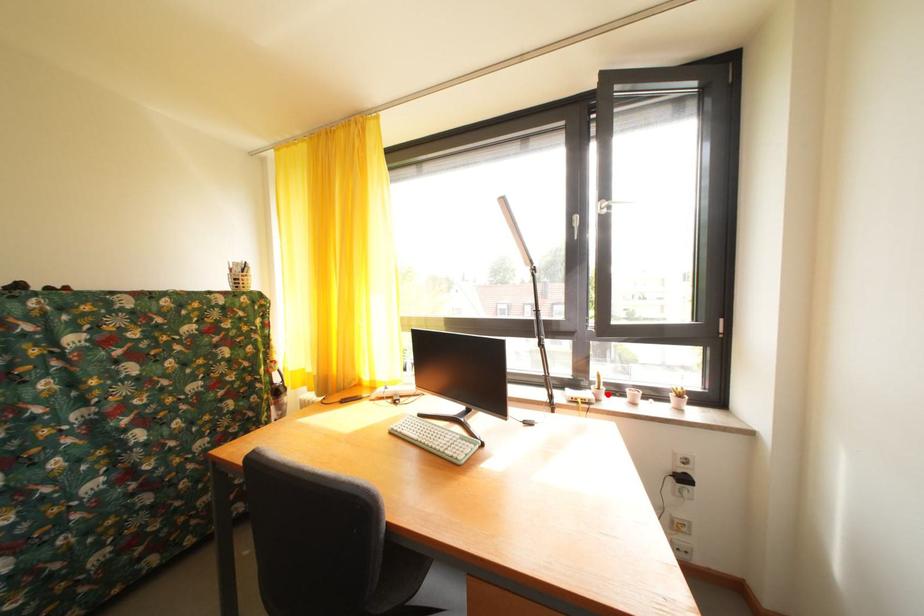
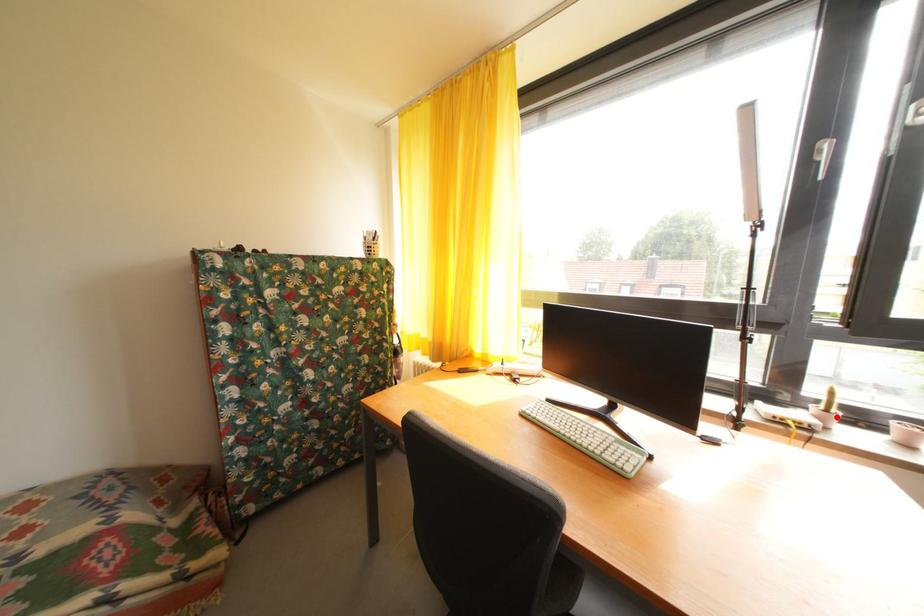
I am providing you with two images of the same scene from different viewpoints. A red point is marked on the first image and another point is marked on the second image. Is the red point in image1 aligned with the point shown in image2?

Yes